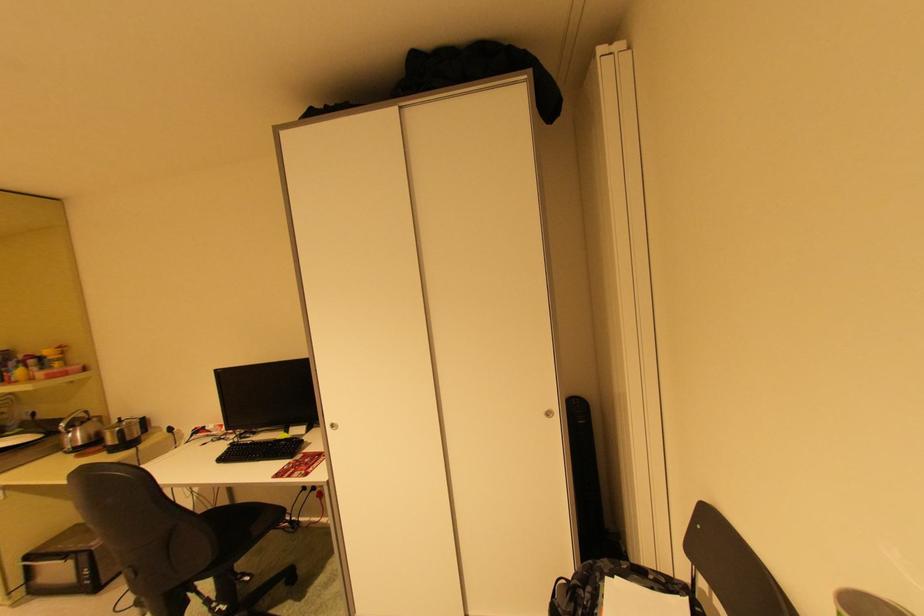
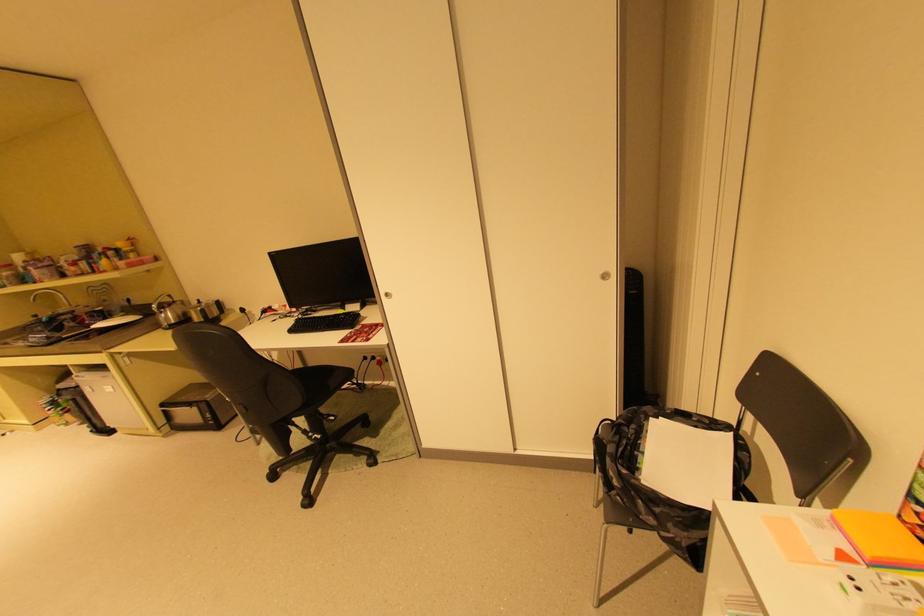
The point at (84, 525) is marked in the first image. Where is the corresponding point in the second image?

(199, 385)